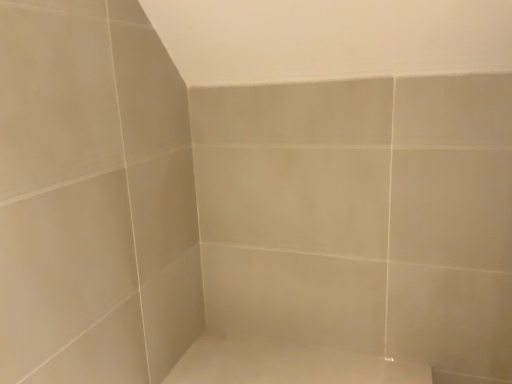
Describe the element at coordinates (286, 363) in the screenshot. I see `white glossy bath at lower center` at that location.

Where is `white glossy bath at lower center`? The image size is (512, 384). white glossy bath at lower center is located at coordinates (286, 363).

Identify the location of white glossy bath at lower center. (286, 363).